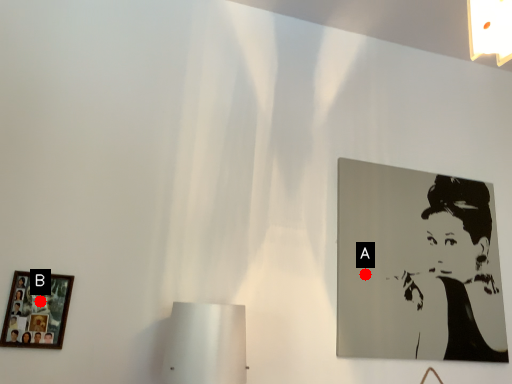
Question: Two points are circled on the image, labeled by A and B beside each circle. Which point appears farthest from the camera in this image?

Choices:
 (A) A is further
 (B) B is further

Answer: (A)